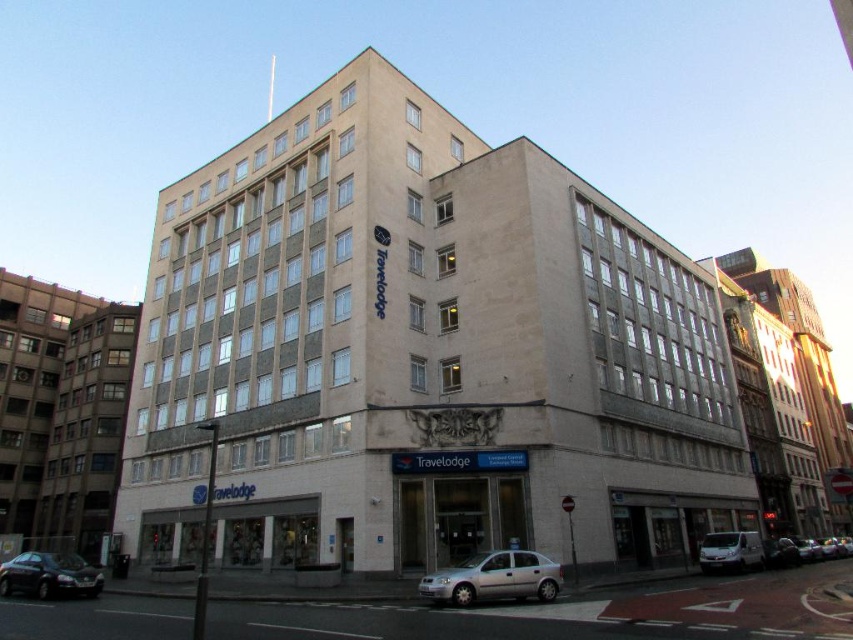
Question: Which of the following is the closest to the observer?

Choices:
 (A) matte black sedan at lower left
 (B) silver metallic car at lower center

Answer: (B)

Question: Which object appears closest to the camera in this image?

Choices:
 (A) matte black sedan at lower left
 (B) silver metallic car at lower center

Answer: (B)

Question: Can you confirm if silver metallic car at lower center is smaller than matte black sedan at lower left?

Choices:
 (A) yes
 (B) no

Answer: (A)

Question: Can you confirm if silver metallic car at lower center is thinner than matte black sedan at lower left?

Choices:
 (A) yes
 (B) no

Answer: (A)

Question: Can you confirm if silver metallic car at lower center is bigger than matte black sedan at lower left?

Choices:
 (A) no
 (B) yes

Answer: (A)

Question: Which point is farther to the camera?

Choices:
 (A) silver metallic car at lower center
 (B) matte black sedan at lower left

Answer: (B)